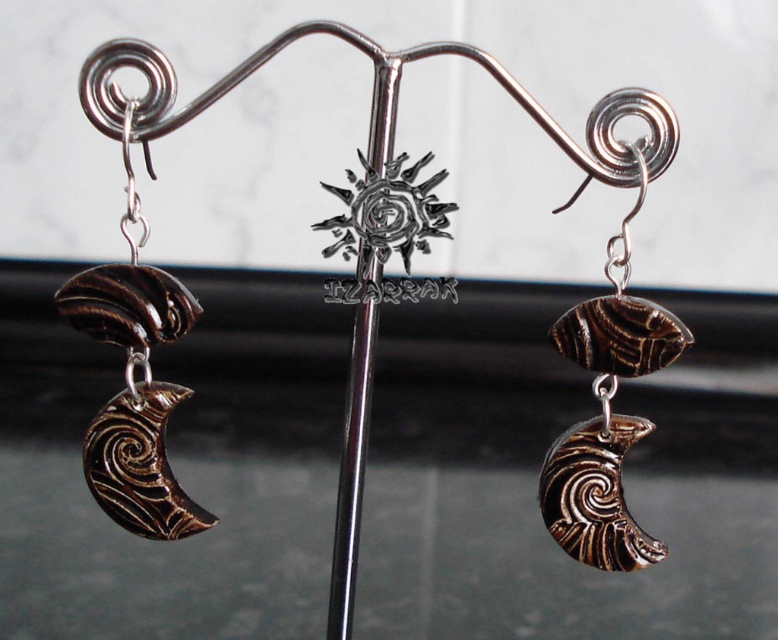
Can you confirm if brown polished crescent moon at lower left is taller than polished silver rod at center?

In fact, brown polished crescent moon at lower left may be shorter than polished silver rod at center.

Does brown polished crescent moon at lower left have a lesser height compared to polished silver rod at center?

Yes.

Image resolution: width=778 pixels, height=640 pixels. What do you see at coordinates (132, 321) in the screenshot?
I see `brown polished crescent moon at lower left` at bounding box center [132, 321].

Locate an element on the screen. The image size is (778, 640). brown polished crescent moon at lower left is located at coordinates (132, 321).

Does brown polished stone crescent moon at center appear over polished silver rod at center?

Correct, brown polished stone crescent moon at center is located above polished silver rod at center.

Consider the image. Who is positioned more to the right, brown polished stone crescent moon at center or polished silver rod at center?

brown polished stone crescent moon at center is more to the right.

Between point (640, 371) and point (373, 170), which one is positioned in front?

Point (373, 170)

Where is `brown polished stone crescent moon at center`? This screenshot has height=640, width=778. brown polished stone crescent moon at center is located at coordinates (610, 365).

Does brown polished crescent moon at lower left have a larger size compared to brown polished stone crescent moon at center?

Yes, brown polished crescent moon at lower left is bigger than brown polished stone crescent moon at center.

Is point (142, 449) positioned behind point (622, 516)?

Yes.

You are a GUI agent. You are given a task and a screenshot of the screen. Output one action in this format:
    pyautogui.click(x=<x>, y=<y>)
    Task: Click on the brown polished crescent moon at lower left
    The height and width of the screenshot is (640, 778).
    Given the screenshot: What is the action you would take?
    pyautogui.click(x=132, y=321)